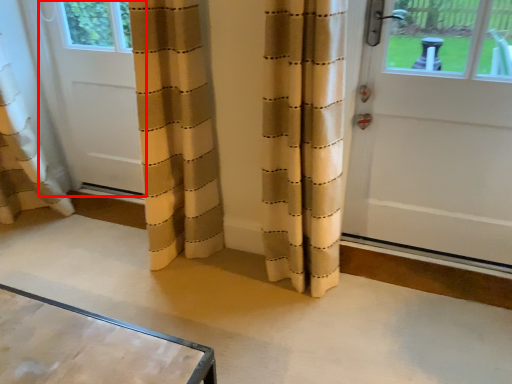
Question: From the image's perspective, where is door (annotated by the red box) located relative to door?

Choices:
 (A) above
 (B) below

Answer: (A)